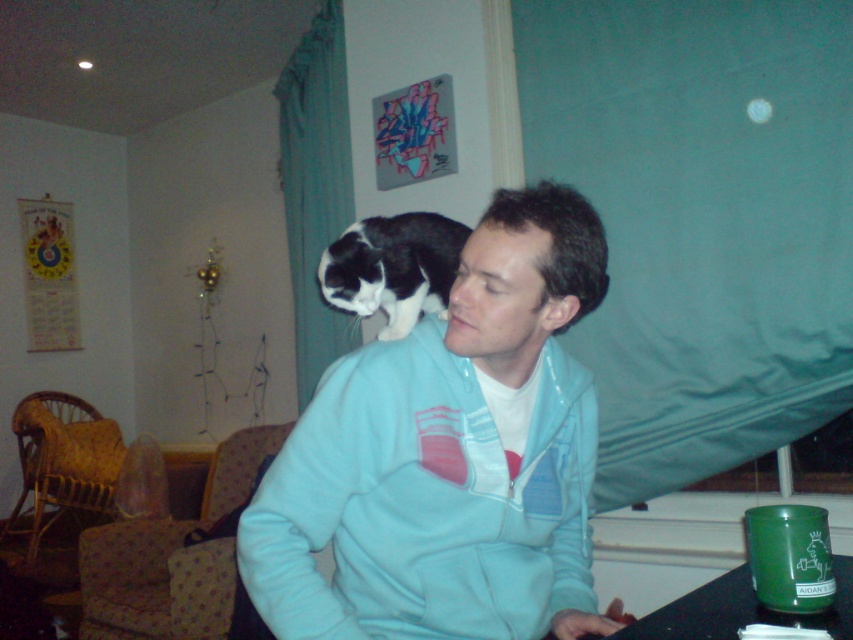
Question: Is matte blue sweatshirt at center positioned before black and white fur cat on shoulder?

Choices:
 (A) yes
 (B) no

Answer: (A)

Question: Which object is the farthest from the matte blue sweatshirt at center?

Choices:
 (A) black and white fur cat on shoulder
 (B) light blue fleece at center

Answer: (A)

Question: Among these objects, which one is nearest to the camera?

Choices:
 (A) black and white fur cat on shoulder
 (B) light blue fleece at center
 (C) matte blue sweatshirt at center

Answer: (C)

Question: Is the position of light blue fleece at center less distant than that of black and white fur cat on shoulder?

Choices:
 (A) yes
 (B) no

Answer: (A)

Question: Does matte blue sweatshirt at center have a smaller size compared to black and white fur cat on shoulder?

Choices:
 (A) no
 (B) yes

Answer: (B)

Question: Which object appears farthest from the camera in this image?

Choices:
 (A) matte blue sweatshirt at center
 (B) black and white fur cat on shoulder

Answer: (B)